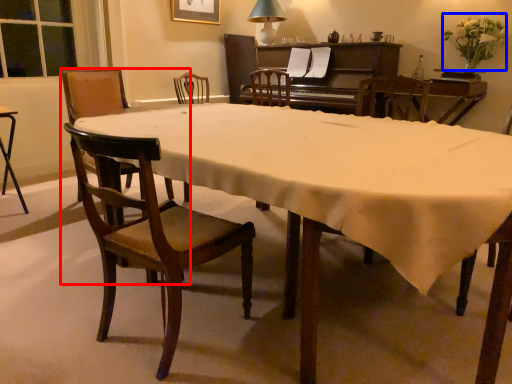
Question: Which of the following is the closest to the observer, chair (highlighted by a red box) or flower (highlighted by a blue box)?

Choices:
 (A) chair
 (B) flower

Answer: (A)